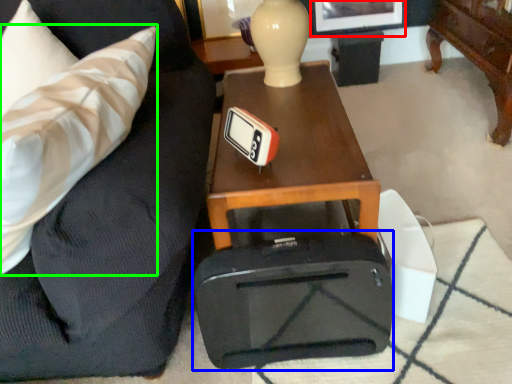
Question: Which is farther away from picture frame (highlighted by a red box)? luggage (highlighted by a blue box) or throw pillow (highlighted by a green box)?

Choices:
 (A) luggage
 (B) throw pillow

Answer: (A)